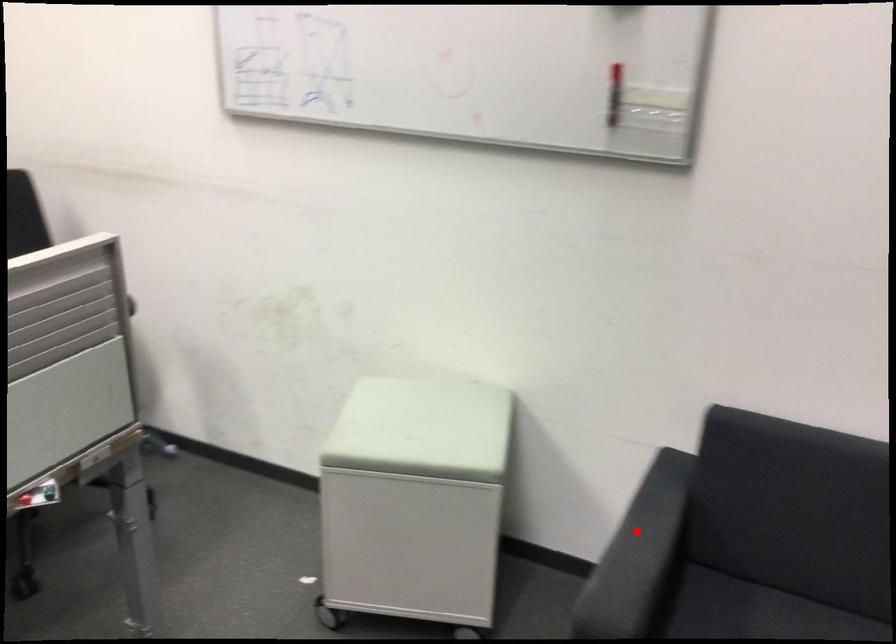
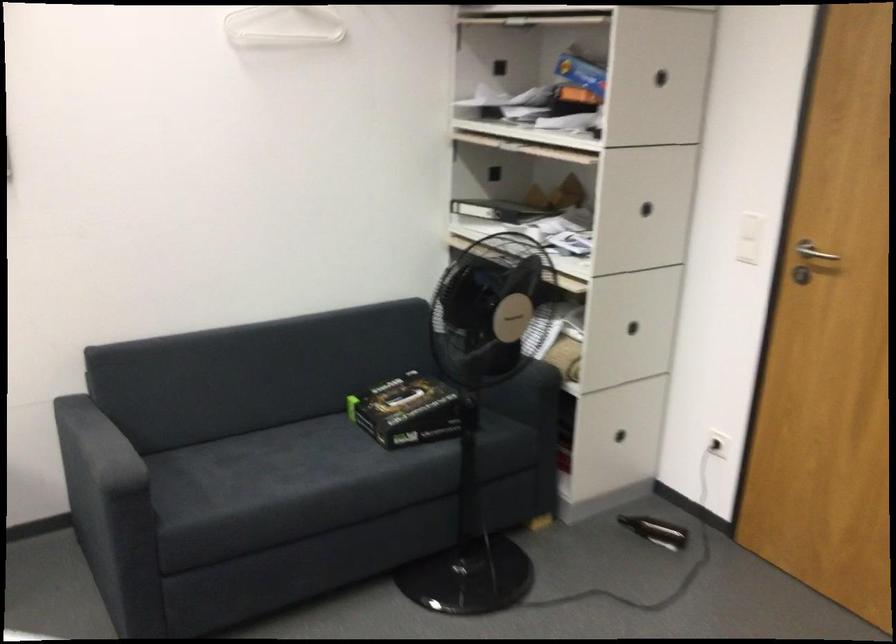
Question: I am providing you with two images of the same scene from different viewpoints. Image1 has a red point marked. In image2, the corresponding 3D location appears at what relative position? Reply with the corresponding letter.

Choices:
 (A) Closer
 (B) Farther

Answer: (B)